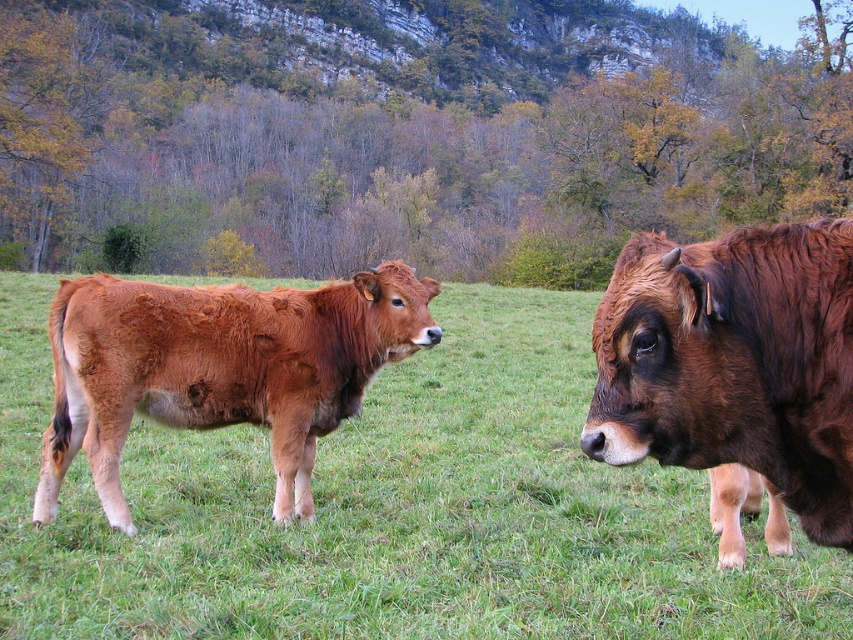
Question: Is green grass at center behind brown glossy cow at right?

Choices:
 (A) yes
 (B) no

Answer: (A)

Question: Is brown glossy cow at right below brown furry calf at left?

Choices:
 (A) yes
 (B) no

Answer: (B)

Question: Is green grass at center below brown furry calf at left?

Choices:
 (A) yes
 (B) no

Answer: (B)

Question: Which object is positioned closest to the brown glossy cow at right?

Choices:
 (A) green grass at center
 (B) brown furry calf at left

Answer: (B)

Question: Which of these objects is positioned closest to the brown furry calf at left?

Choices:
 (A) green grass at center
 (B) brown glossy cow at right

Answer: (A)

Question: Which object appears farthest from the camera in this image?

Choices:
 (A) brown glossy cow at right
 (B) brown furry calf at left
 (C) green grass at center

Answer: (B)